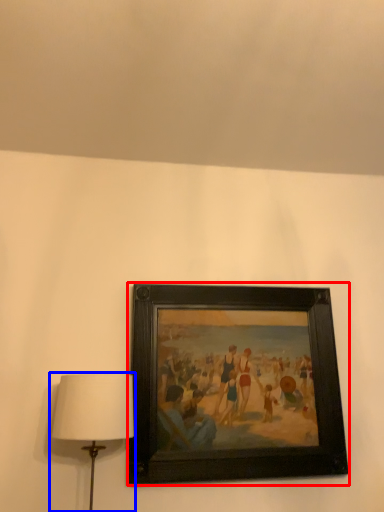
Question: Among these objects, which one is farthest to the camera, picture frame (highlighted by a red box) or lamp (highlighted by a blue box)?

Choices:
 (A) picture frame
 (B) lamp

Answer: (A)